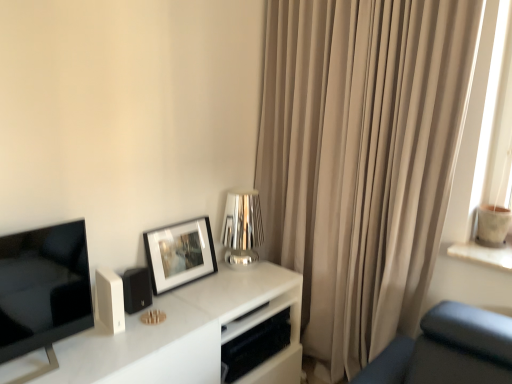
What are the coordinates of `free space in front of matte black speaker at lower left` in the screenshot? It's located at (125, 334).